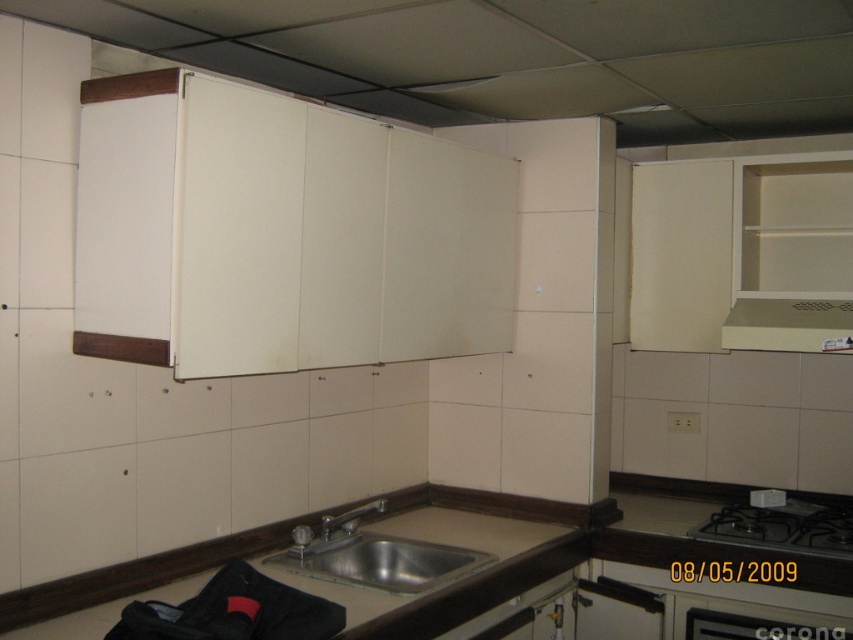
You are a kitchen designer planning to place a new appliance on the brown laminate counter top at lower center and the black matte stove at lower right. Based on their sizes, which object can accommodate a larger appliance?

The brown laminate counter top at lower center has a larger size compared to the black matte stove at lower right, so it can accommodate a larger appliance.

You are a kitchen designer assessing the layout. You need to install a new ventilation system that requires a vent hood above the stove. Given the height difference between the stainless steel sink at center and the black matte stove at lower right, which appliance should the vent hood be placed above?

The vent hood should be placed above the black matte stove at lower right because the stainless steel sink at center is taller than the stove, so the vent hood needs to be positioned above the stove to ensure proper ventilation and functionality.

You are a contractor assessing the kitchen layout. You need to install a new ventilation system component. The beige matte exhaust hood at upper right is in the way of the installation path. Can you move past it to access the area behind it where the silver metallic faucet at sink center is located?

The beige matte exhaust hood at upper right is further to the viewer than the silver metallic faucet at sink center, so it is blocking the direct path to the faucet. To access the area behind the exhaust hood where the faucet is located, you would need to move around or temporarily remove the exhaust hood.